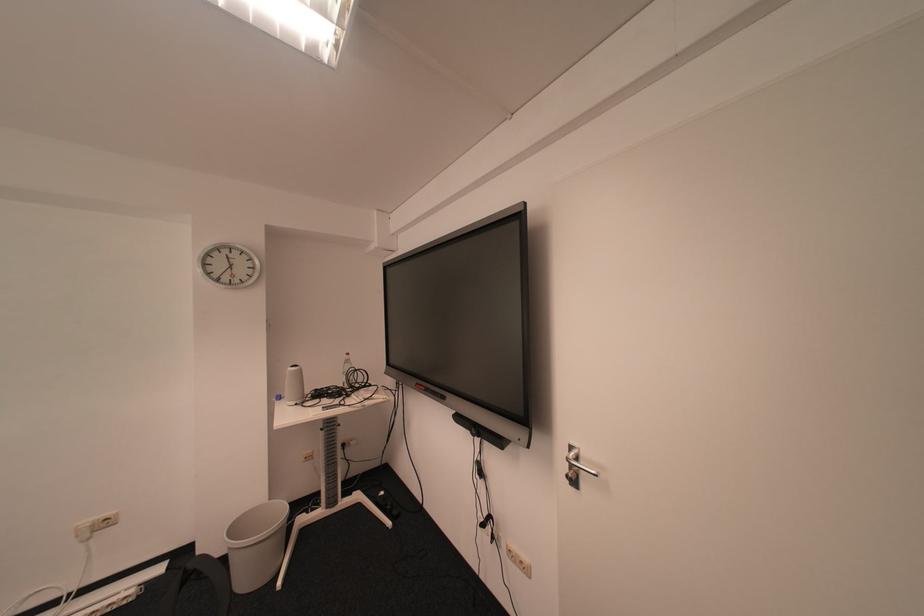
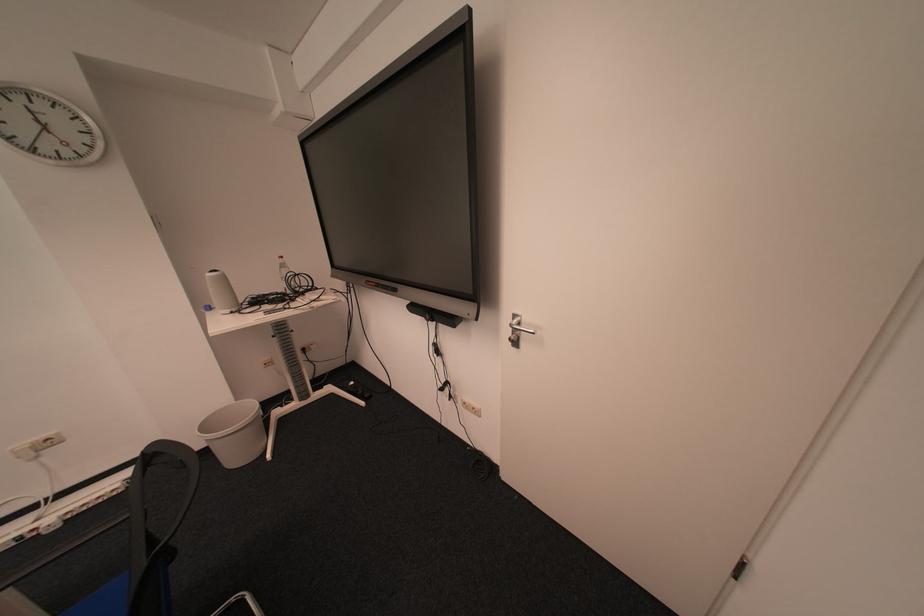
Locate, in the second image, the point that corresponds to pixel 290 398 in the first image.

(221, 309)